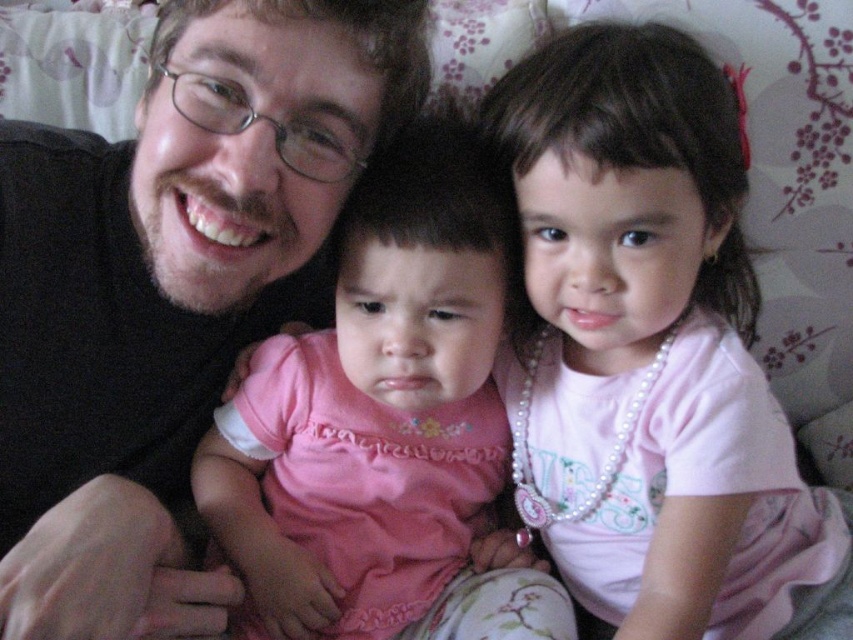
Describe the element at coordinates (167, 291) in the screenshot. I see `matte black shirt at left` at that location.

Is matte black shirt at left to the right of pink satin dress at center from the viewer's perspective?

In fact, matte black shirt at left is to the left of pink satin dress at center.

Where is `matte black shirt at left`? The height and width of the screenshot is (640, 853). matte black shirt at left is located at coordinates (167, 291).

Is pearl necklace at upper right taller than pink satin dress at center?

Yes.

Is pearl necklace at upper right positioned in front of pink satin dress at center?

Yes, pearl necklace at upper right is closer to the viewer.

Which is in front, point (695, 326) or point (305, 627)?

Point (695, 326) is more forward.

Find the location of a particular element. This screenshot has width=853, height=640. pearl necklace at upper right is located at coordinates (653, 353).

Is matte black shirt at left shorter than pearl necklace at upper right?

Indeed, matte black shirt at left has a lesser height compared to pearl necklace at upper right.

Can you confirm if matte black shirt at left is wider than pearl necklace at upper right?

Indeed, matte black shirt at left has a greater width compared to pearl necklace at upper right.

This screenshot has width=853, height=640. What do you see at coordinates (167, 291) in the screenshot?
I see `matte black shirt at left` at bounding box center [167, 291].

Where is `matte black shirt at left`? The height and width of the screenshot is (640, 853). matte black shirt at left is located at coordinates (167, 291).